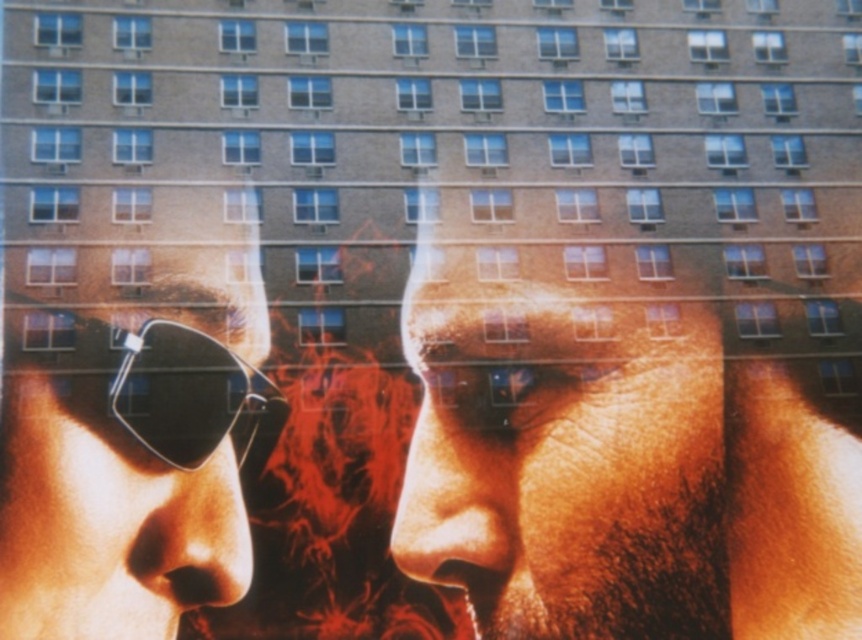
Based on the photo, you are trying to decide which eyewear to choose for a hiking trip. You see the matte black sunglasses at left and the black matte goggles at left in the image. Which one has a bigger frame size?

The matte black sunglasses at left has a larger frame size than the black matte goggles at left.

You are an artist trying to sketch the scene. You notice two elements in the foreground. Which one is taller between the smooth skin face at center and the matte black sunglasses at left?

The smooth skin face at center is much taller than the matte black sunglasses at left.

You are taking a photo of the two points in the image. The camera is positioned at your eye level. Which point, point [515,598] or point [86,422], will appear closer to the bottom edge of the photo?

Point [86,422] will appear closer to the bottom edge of the photo because it is closer to the camera than point [515,598], which is further away.